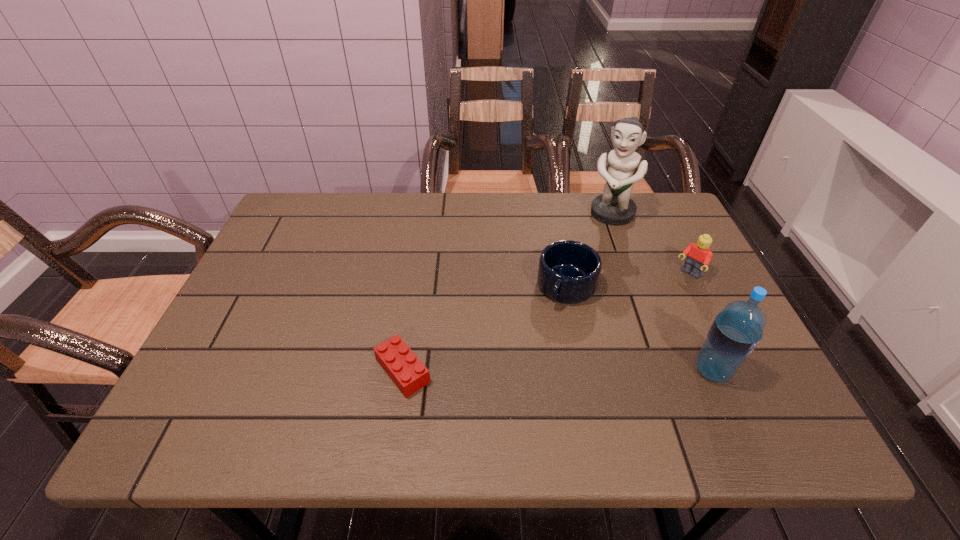
Image resolution: width=960 pixels, height=540 pixels. Identify the location of the leftmost object. (409, 374).

Locate an element on the screen. the nearer Lego is located at coordinates (409, 374).

Image resolution: width=960 pixels, height=540 pixels. In order to click on water bottle in this screenshot , I will do `click(737, 329)`.

Locate an element on the screen. mug is located at coordinates (568, 272).

The image size is (960, 540). I want to click on the second shortest object, so click(x=568, y=272).

Where is `the third shortest object`? the third shortest object is located at coordinates (699, 255).

The image size is (960, 540). In order to click on the taller Lego in this screenshot , I will do `click(699, 255)`.

You are a GUI agent. You are given a task and a screenshot of the screen. Output one action in this format:
    pyautogui.click(x=<x>, y=<y>)
    Task: Click on the farthest object
    This screenshot has height=540, width=960.
    Given the screenshot: What is the action you would take?
    pyautogui.click(x=614, y=207)

Locate an element on the screen. This screenshot has height=540, width=960. figurine is located at coordinates (614, 207).

This screenshot has width=960, height=540. What are the coordinates of `vacant region located 0.110m on the left of the shorter Lego` in the screenshot? It's located at (322, 371).